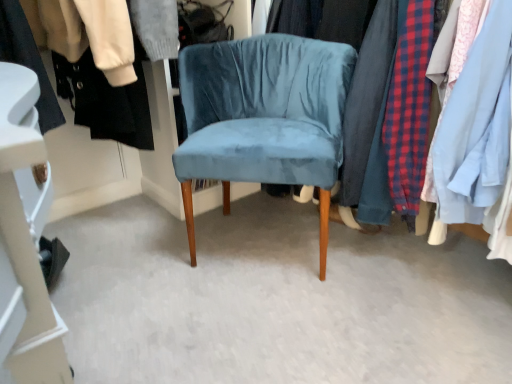
Question: Considering the positions of black fabric shoe at lower left, the first closet positioned from the left, and velvet blue chair at center in the image, is black fabric shoe at lower left, the first closet positioned from the left, bigger or smaller than velvet blue chair at center?

Choices:
 (A) small
 (B) big

Answer: (A)

Question: Is point (24, 264) closer or farther from the camera than point (272, 49)?

Choices:
 (A) farther
 (B) closer

Answer: (B)

Question: Which of these objects is positioned closest to the velvet fabric clothes at center, positioned as the first closet in right-to-left order?

Choices:
 (A) black fabric shoe at lower left, positioned as the 2th closet in right-to-left order
 (B) velvet blue chair at center

Answer: (B)

Question: Based on their relative distances, which object is nearer to the velvet fabric clothes at center, the second closet from the left?

Choices:
 (A) black fabric shoe at lower left, the first closet positioned from the left
 (B) velvet blue chair at center

Answer: (B)